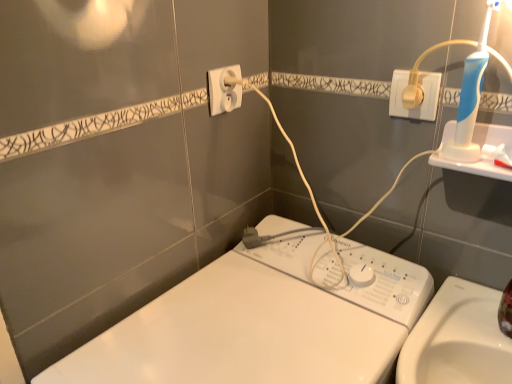
Question: From a real-world perspective, is white plastic washing machine at center below white plastic socket at upper center, marked as the 2th power plugs and sockets in a right-to-left arrangement?

Choices:
 (A) no
 (B) yes

Answer: (B)

Question: Is the position of white plastic washing machine at center more distant than that of white plastic socket at upper center, the 1th power plugs and sockets positioned from the left?

Choices:
 (A) yes
 (B) no

Answer: (B)

Question: Is white plastic washing machine at center wider than white plastic socket at upper center, the 1th power plugs and sockets positioned from the left?

Choices:
 (A) yes
 (B) no

Answer: (A)

Question: Does white plastic washing machine at center have a lesser height compared to white plastic socket at upper center, the 1th power plugs and sockets positioned from the left?

Choices:
 (A) yes
 (B) no

Answer: (B)

Question: Is white plastic washing machine at center not inside white plastic socket at upper center, marked as the 2th power plugs and sockets in a right-to-left arrangement?

Choices:
 (A) yes
 (B) no

Answer: (A)

Question: In the image, is white plastic washing machine at center positioned in front of or behind white plastic socket at upper center, marked as the 2th power plugs and sockets in a right-to-left arrangement?

Choices:
 (A) front
 (B) behind

Answer: (A)

Question: Is point click(x=261, y=345) closer or farther from the camera than point click(x=209, y=92)?

Choices:
 (A) farther
 (B) closer

Answer: (B)

Question: From a real-world perspective, relative to white plastic socket at upper center, marked as the 2th power plugs and sockets in a right-to-left arrangement, is white plastic washing machine at center vertically above or below?

Choices:
 (A) above
 (B) below

Answer: (B)

Question: In terms of height, does white plastic washing machine at center look taller or shorter compared to white plastic socket at upper center, the 1th power plugs and sockets positioned from the left?

Choices:
 (A) short
 (B) tall

Answer: (B)

Question: Is point (429, 117) positioned closer to the camera than point (164, 355)?

Choices:
 (A) closer
 (B) farther

Answer: (B)

Question: In terms of height, does white plastic plug at upper right, arranged as the first power plugs and sockets when viewed from the right, look taller or shorter compared to white plastic washing machine at center?

Choices:
 (A) tall
 (B) short

Answer: (B)

Question: Relative to white plastic washing machine at center, is white plastic plug at upper right, arranged as the first power plugs and sockets when viewed from the right, in front or behind?

Choices:
 (A) front
 (B) behind

Answer: (B)

Question: Is white plastic plug at upper right, arranged as the first power plugs and sockets when viewed from the right, to the left or to the right of white plastic washing machine at center in the image?

Choices:
 (A) right
 (B) left

Answer: (A)

Question: Considering the positions of white plastic washing machine at center and white plastic plug at upper right, arranged as the first power plugs and sockets when viewed from the right, in the image, is white plastic washing machine at center taller or shorter than white plastic plug at upper right, arranged as the first power plugs and sockets when viewed from the right,?

Choices:
 (A) short
 (B) tall

Answer: (B)

Question: Looking at their shapes, would you say white plastic washing machine at center is wider or thinner than white plastic plug at upper right, arranged as the first power plugs and sockets when viewed from the right?

Choices:
 (A) thin
 (B) wide

Answer: (B)